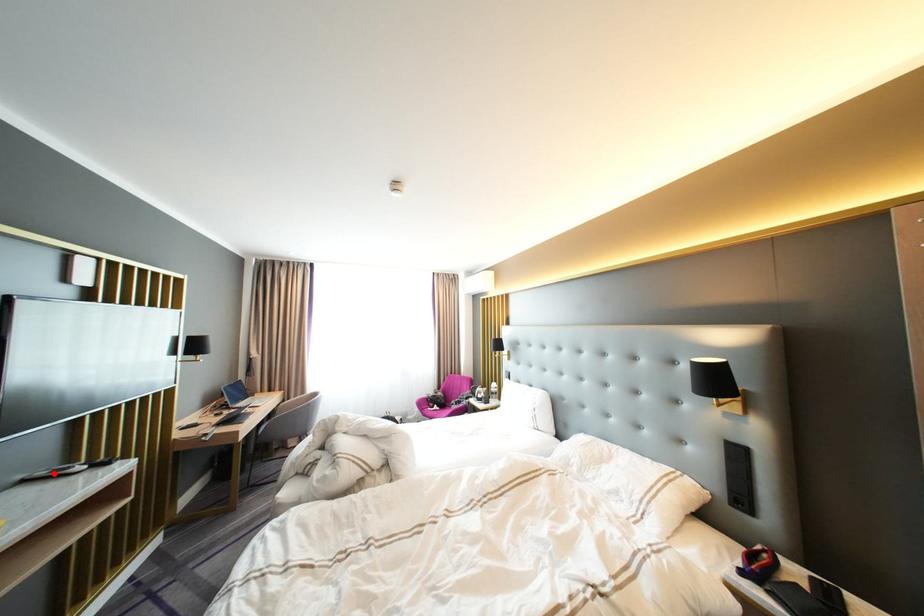
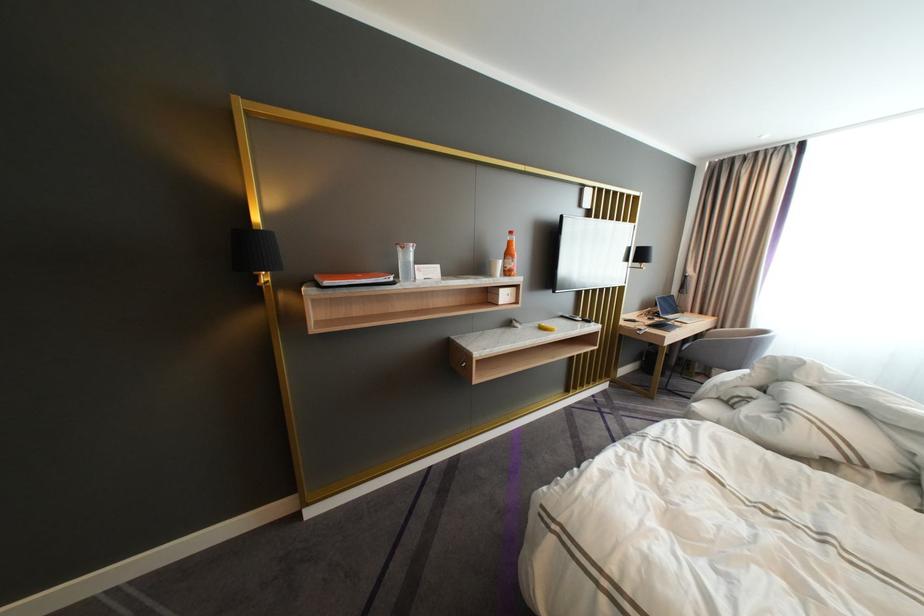
Locate, in the second image, the point that corresponds to the highlighted location in the first image.

(578, 315)